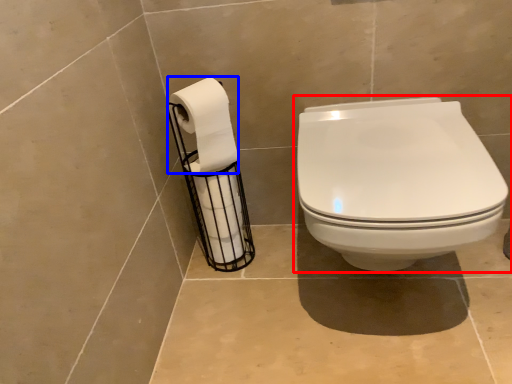
Question: Which of the following is the farthest to the observer, toilet (highlighted by a red box) or toilet paper (highlighted by a blue box)?

Choices:
 (A) toilet
 (B) toilet paper

Answer: (B)